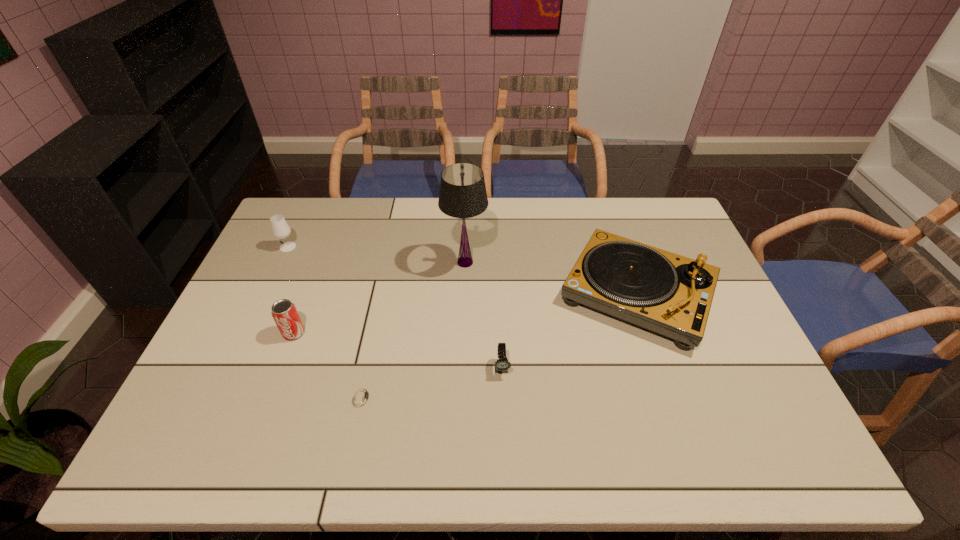
This screenshot has width=960, height=540. I want to click on unoccupied position between the fourth object from left to right and the fifth object from right to left, so click(379, 298).

Identify which object is the second nearest to the record player. Please provide its 2D coordinates. Your answer should be formatted as a tuple, i.e. [(x, y)], where the tuple contains the x and y coordinates of a point satisfying the conditions above.

[(462, 194)]

Select which object is the second closest to the fourth object from right to left. Please provide its 2D coordinates. Your answer should be formatted as a tuple, i.e. [(x, y)], where the tuple contains the x and y coordinates of a point satisfying the conditions above.

[(502, 364)]

This screenshot has width=960, height=540. Find the location of `free spot that satisfies the following two spatial constraints: 1. on the front side of the leftmost object; 2. on the right side of the record player`. free spot that satisfies the following two spatial constraints: 1. on the front side of the leftmost object; 2. on the right side of the record player is located at coordinates (266, 294).